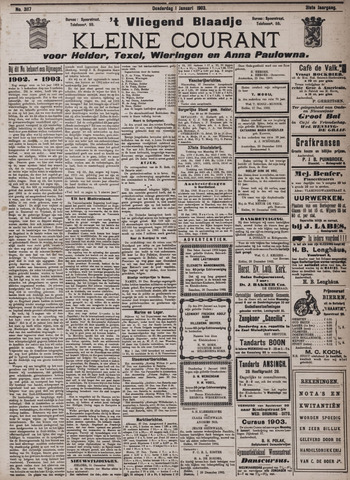
The height and width of the screenshot is (480, 350). What are the coordinates of `newspaper` in the screenshot? It's located at (139, 233).